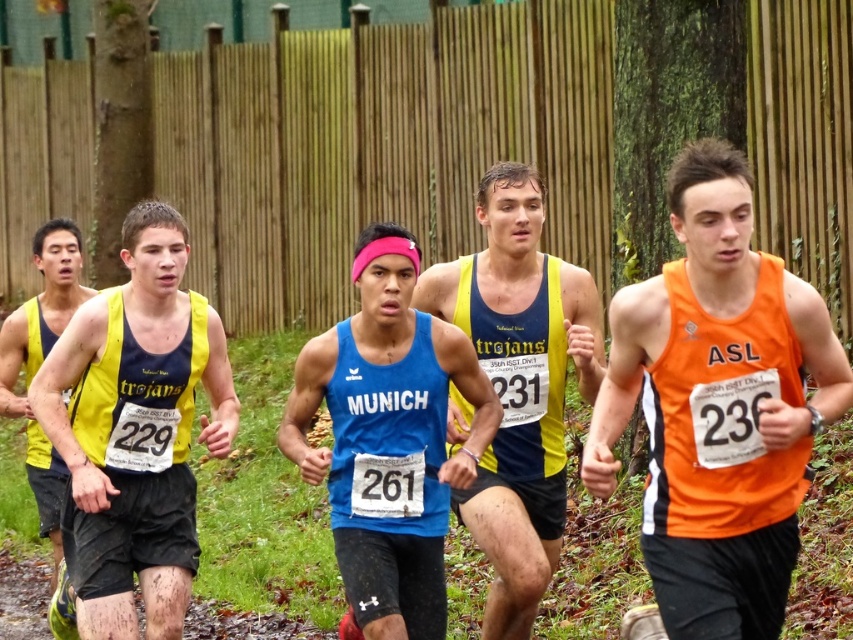
You are a race official and need to determine the current position of the runners. Based on the image, which runner is leading the race between the blue matte tank top at center and the yellow fabric tank top at left?

The blue matte tank top at center is leading the race because it is positioned in front of the yellow fabric tank top at left.